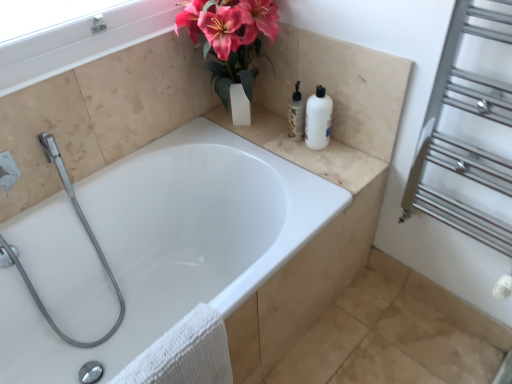
Where is `vacant space that is to the left of white plastic bottle at upper right`? vacant space that is to the left of white plastic bottle at upper right is located at coordinates (286, 148).